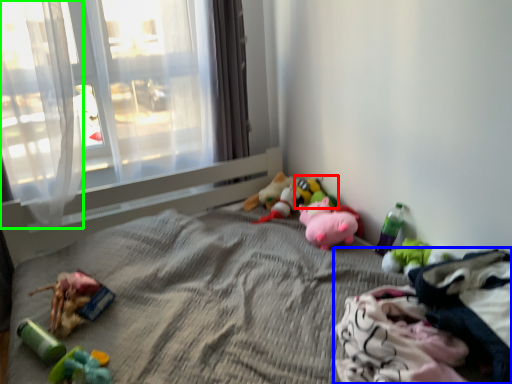
Question: Which object is positioned farthest from toy (highlighted by a red box)? Select from material (highlighted by a blue box) and curtain (highlighted by a green box).

Choices:
 (A) material
 (B) curtain

Answer: (B)